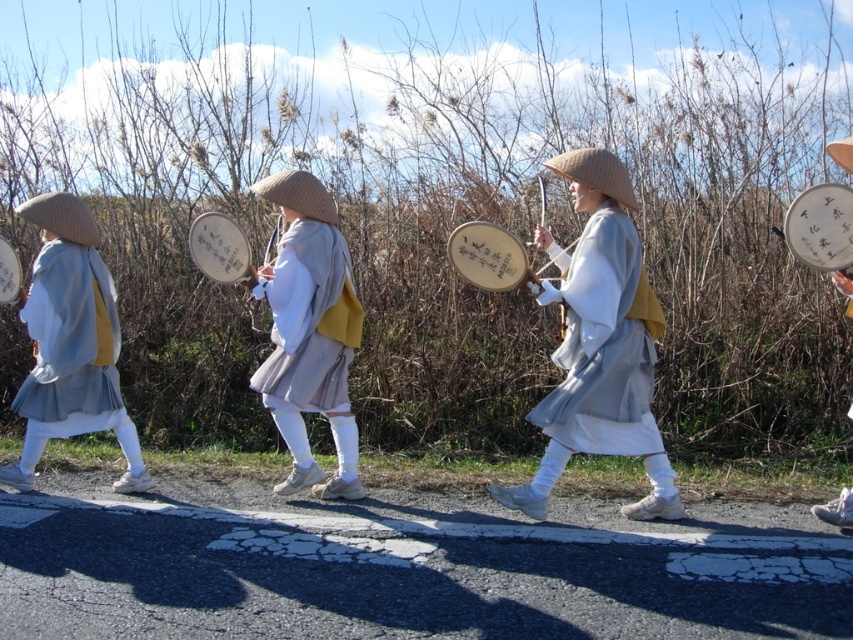
Question: Based on their relative distances, which object is nearer to the matte gray robe at center?

Choices:
 (A) matte white drum at right
 (B) matte gray kimono at left
 (C) white wooden drum at right
 (D) wooden drum at center

Answer: (C)

Question: Does matte white drum at right appear on the right side of wooden drum at left?

Choices:
 (A) no
 (B) yes

Answer: (B)

Question: Considering the real-world distances, which object is farthest from the matte gray kimono at center?

Choices:
 (A) matte gray robe at center
 (B) matte white drum at right

Answer: (B)

Question: Among these points, which one is nearest to the camera?

Choices:
 (A) (529, 512)
 (B) (39, 369)

Answer: (A)

Question: Does matte gray robe at center have a lesser width compared to matte white drum at right?

Choices:
 (A) yes
 (B) no

Answer: (B)

Question: Can you confirm if matte gray robe at center is positioned to the left of wooden drum at center?

Choices:
 (A) yes
 (B) no

Answer: (B)